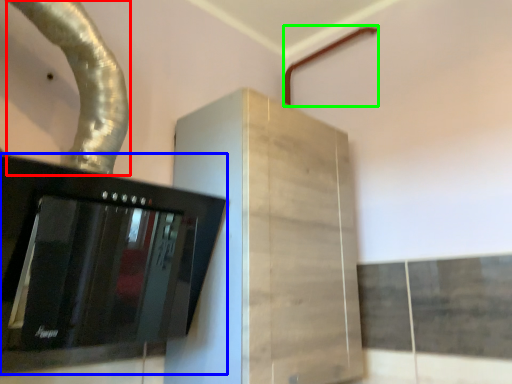
Question: Which object is positioned farthest from water pipe (highlighted by a red box)? Select from home appliance (highlighted by a blue box) and pipe (highlighted by a green box).

Choices:
 (A) home appliance
 (B) pipe

Answer: (B)